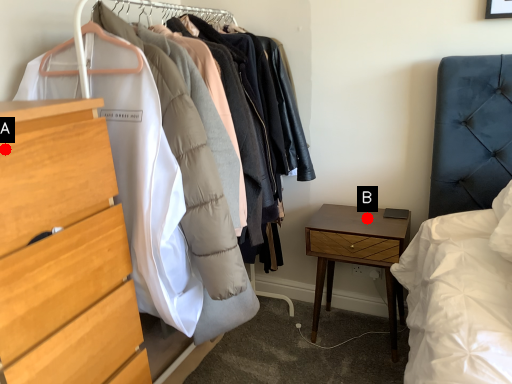
Question: Two points are circled on the image, labeled by A and B beside each circle. Among these points, which one is nearest to the camera?

Choices:
 (A) A is closer
 (B) B is closer

Answer: (A)